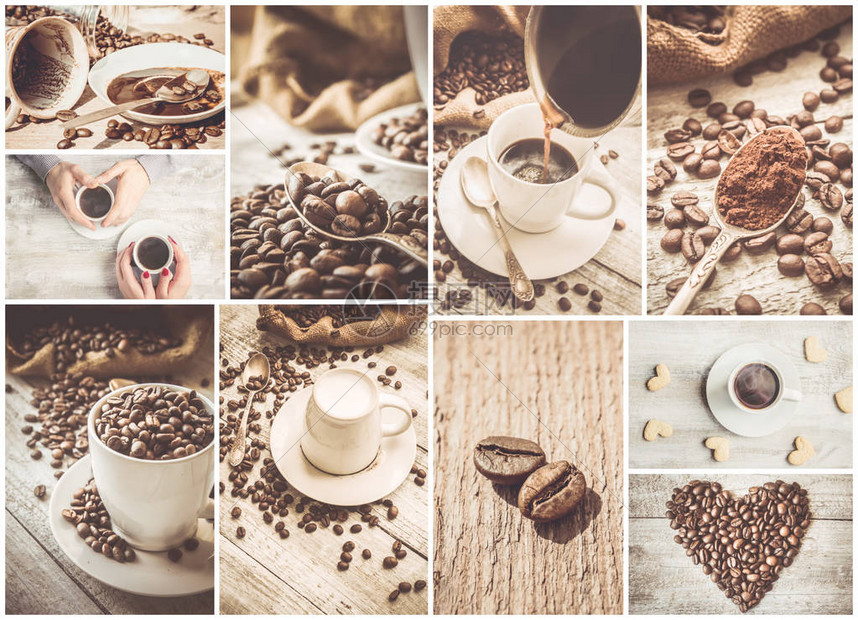
Locate an element on the screen. The width and height of the screenshot is (858, 620). spoon is located at coordinates (174, 87), (312, 198), (474, 170), (780, 178).